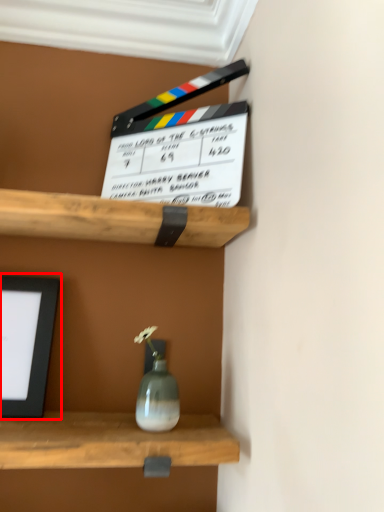
Question: From the image's perspective, what is the correct spatial relationship of picture frame (annotated by the red box) in relation to window frame?

Choices:
 (A) above
 (B) below

Answer: (B)